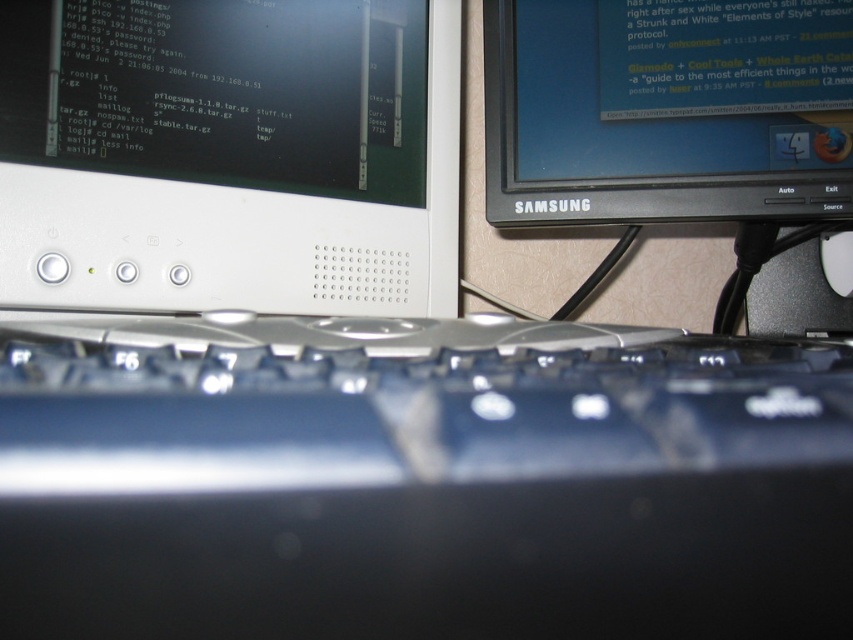
Question: Can you confirm if white plastic monitor at upper center is positioned below black glossy monitor at upper right?

Choices:
 (A) no
 (B) yes

Answer: (B)

Question: Does black plastic keyboard at center appear on the right side of black glossy monitor at upper right?

Choices:
 (A) yes
 (B) no

Answer: (B)

Question: Which of the following is the closest to the observer?

Choices:
 (A) white plastic monitor at upper center
 (B) white plastic mouse at center
 (C) black plastic keyboard at center
 (D) black glossy monitor at upper right

Answer: (C)

Question: Among these points, which one is nearest to the camera?

Choices:
 (A) (578, 170)
 (B) (824, 243)

Answer: (A)

Question: Can you confirm if black plastic keyboard at center is smaller than black glossy monitor at upper right?

Choices:
 (A) no
 (B) yes

Answer: (A)

Question: Which point is closer to the camera?

Choices:
 (A) white plastic monitor at upper center
 (B) white plastic mouse at center
 (C) black glossy monitor at upper right
 (D) black plastic keyboard at center

Answer: (D)